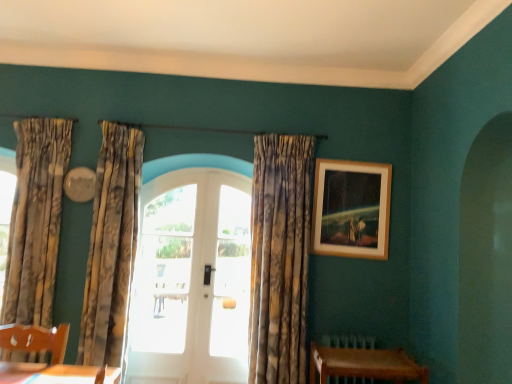
Find the location of a particular element. Image resolution: width=512 pixels, height=384 pixels. free point above wooden frame at upper right (from a real-world perspective) is located at coordinates coord(350,160).